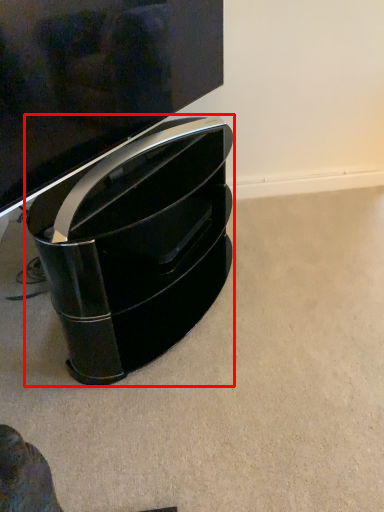
Question: In this image, where is furniture (annotated by the red box) located relative to television?

Choices:
 (A) right
 (B) left

Answer: (A)